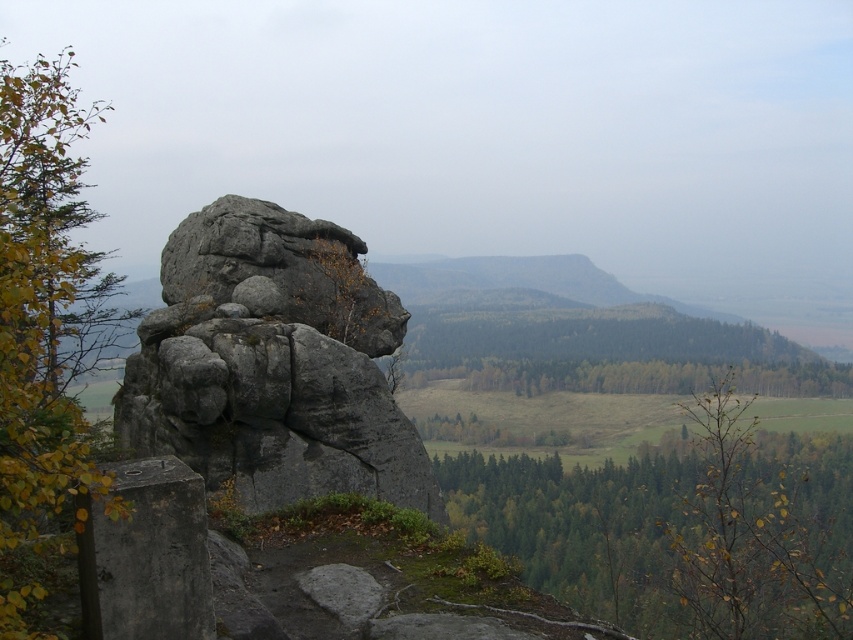
Question: Does yellow-green leaves at left have a greater width compared to green leafy trees at center?

Choices:
 (A) yes
 (B) no

Answer: (B)

Question: Which of these objects is positioned farthest from the yellow-green leaves at left?

Choices:
 (A) green leafy tree at lower center
 (B) gray rough rock at center

Answer: (A)

Question: Which object appears farthest from the camera in this image?

Choices:
 (A) green leafy tree at lower center
 (B) green leafy trees at center
 (C) yellow-green leaves at left

Answer: (B)

Question: Is green leafy tree at lower center thinner than yellow-green leaves at left?

Choices:
 (A) yes
 (B) no

Answer: (A)

Question: Among these objects, which one is farthest from the camera?

Choices:
 (A) green leafy trees at center
 (B) gray rough rock at center
 (C) yellow-green leaves at left

Answer: (A)

Question: In this image, where is green leafy tree at lower center located relative to yellow-green leaves at left?

Choices:
 (A) below
 (B) above

Answer: (A)